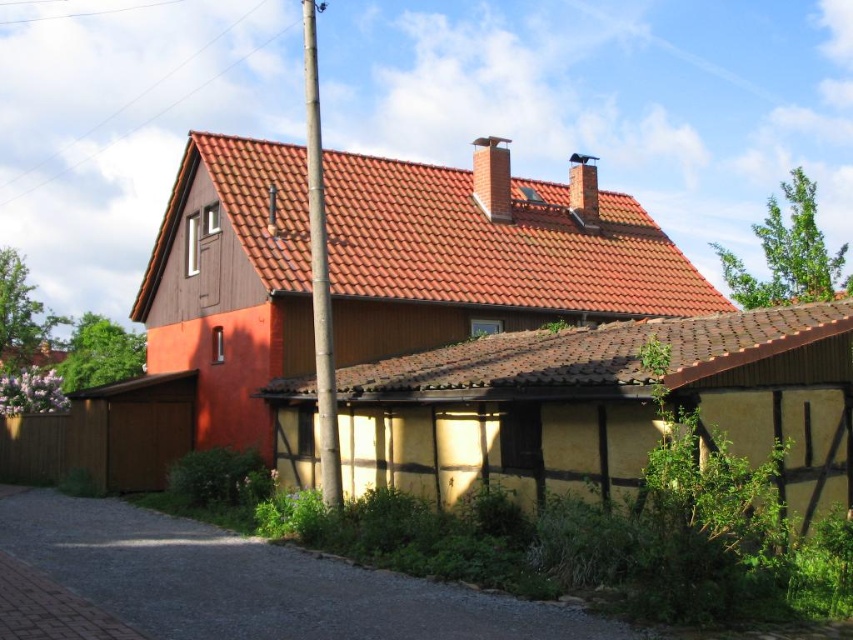
You are an architect analyzing the roof structure of the house. Which chimney, the smooth gray chimney at upper center or the smooth brick chimney at upper center, is located higher on the roof?

The smooth gray chimney at upper center is positioned over the smooth brick chimney at upper center, so it is higher on the roof.

You are standing in front of the traditional house and notice a smooth bamboo pole at center and a smooth gray chimney at upper center. From your perspective, which object is positioned to the left?

The smooth bamboo pole at center is positioned to the left of the smooth gray chimney at upper center.